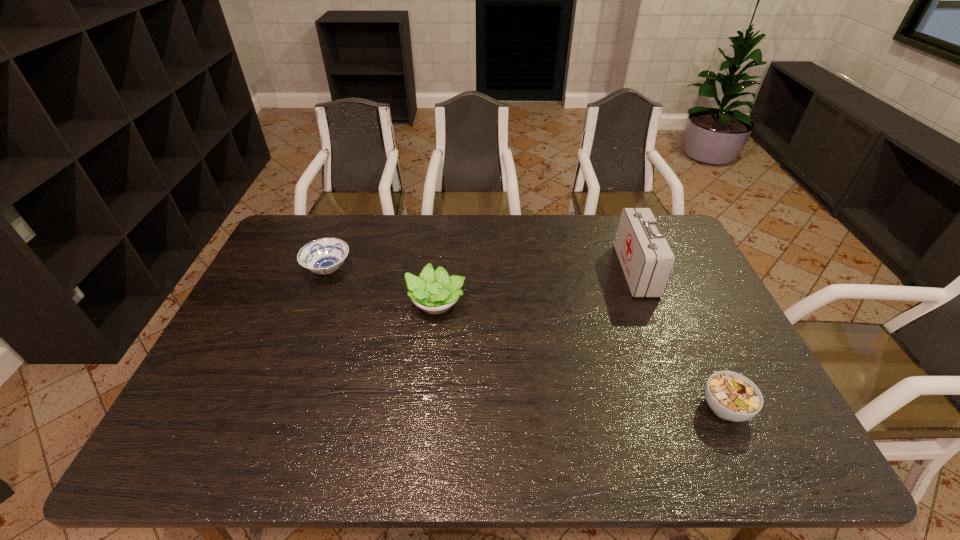
At what (x,y) coordinates should I click in order to perform the action: click on vacant area situated on the back of the third shortest object. Please return your answer as a coordinate pair (x, y). Looking at the image, I should click on (439, 269).

At what (x,y) coordinates should I click in order to perform the action: click on vacant space located 0.090m on the front of the farther soup bowl. Please return your answer as a coordinate pair (x, y). This screenshot has height=540, width=960. Looking at the image, I should click on (314, 307).

Identify the location of free space located 0.310m on the back of the right soup bowl. (675, 300).

I want to click on the first-aid kit that is positioned at the far edge, so click(647, 260).

I want to click on soup bowl present at the far edge, so click(323, 256).

This screenshot has height=540, width=960. In order to click on object present at the near edge in this screenshot , I will do `click(731, 396)`.

Identify the location of object at the left edge. This screenshot has width=960, height=540. (323, 256).

The width and height of the screenshot is (960, 540). I want to click on the first-aid kit situated at the right edge, so click(x=647, y=260).

Locate an element on the screen. The width and height of the screenshot is (960, 540). soup bowl positioned at the right edge is located at coordinates (731, 396).

Locate an element on the screen. object present at the far left corner is located at coordinates (323, 256).